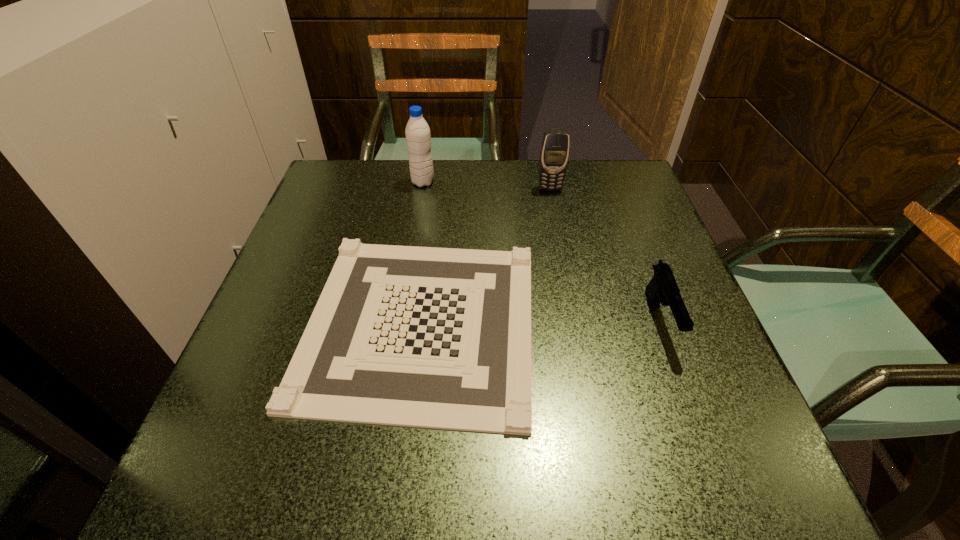
What are the coordinates of `water bottle positioned at the far edge` in the screenshot? It's located at 418,138.

Locate an element on the screen. cellular telephone at the far edge is located at coordinates [x=554, y=154].

Identify the location of object present at the left edge. Image resolution: width=960 pixels, height=540 pixels. 428,337.

Locate an element on the screen. This screenshot has width=960, height=540. object present at the right edge is located at coordinates (662, 288).

I want to click on free region at the far edge, so click(x=515, y=170).

Where is `free region at the near edge of the desktop`? The image size is (960, 540). free region at the near edge of the desktop is located at coordinates (376, 454).

Locate an element on the screen. The height and width of the screenshot is (540, 960). vacant region at the left edge of the desktop is located at coordinates (276, 281).

In the image, there is a desktop. Where is `vacant area at the right edge`? vacant area at the right edge is located at coordinates click(x=623, y=239).

In the image, there is a desktop. Where is `blank space at the near left corner`? Image resolution: width=960 pixels, height=540 pixels. blank space at the near left corner is located at coordinates (204, 440).

In the image, there is a desktop. Where is `vacant space at the far right corner`? vacant space at the far right corner is located at coordinates (613, 174).